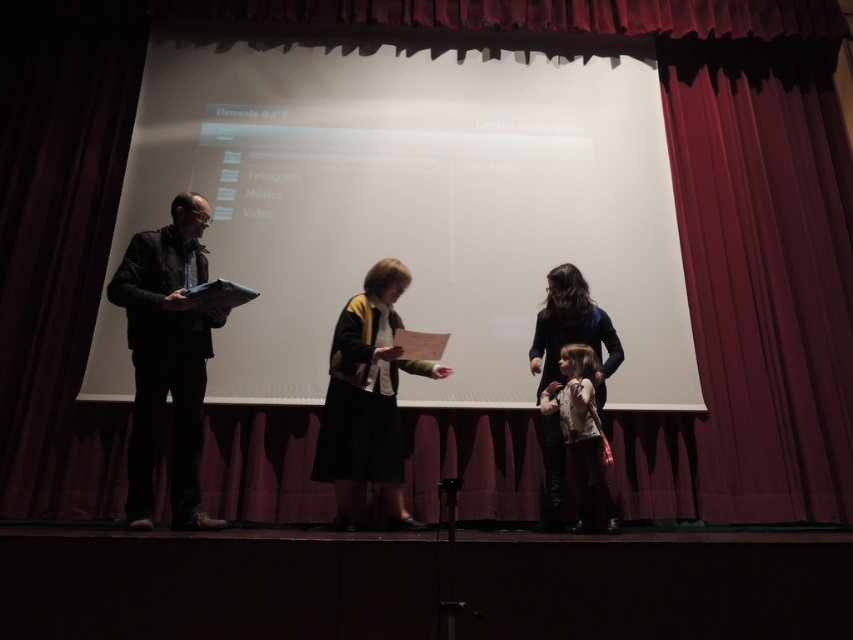
Is dark brown leather jacket at left to the left of dark woolen sweater at center from the viewer's perspective?

Yes, dark brown leather jacket at left is to the left of dark woolen sweater at center.

In the scene shown: Does dark brown leather jacket at left have a lesser width compared to dark woolen sweater at center?

Yes.

Is point (189, 211) in front of point (370, 339)?

Yes, point (189, 211) is in front of point (370, 339).

Locate an element on the screen. Image resolution: width=853 pixels, height=640 pixels. dark brown leather jacket at left is located at coordinates (167, 358).

Is dark brown leather jacket at left taller than floral-patterned sweater at center?

Correct, dark brown leather jacket at left is much taller as floral-patterned sweater at center.

The width and height of the screenshot is (853, 640). I want to click on dark brown leather jacket at left, so click(167, 358).

Identify the location of dark brown leather jacket at left. (167, 358).

Does dark woolen sweater at center appear over floral-patterned sweater at center?

Correct, dark woolen sweater at center is located above floral-patterned sweater at center.

Which is behind, point (398, 266) or point (604, 506)?

Point (398, 266)

Who is more forward, (370, 369) or (561, 388)?

Positioned in front is point (370, 369).

Find the location of a particular element. This screenshot has width=853, height=640. dark woolen sweater at center is located at coordinates (367, 397).